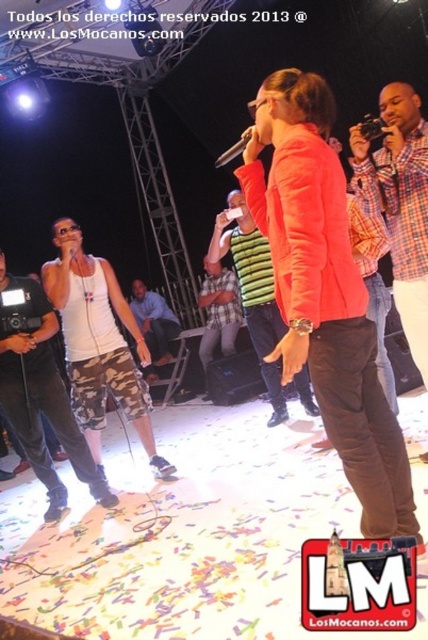
Between point (365, 161) and point (225, 308), which one is positioned in front?

Point (365, 161)

Can you confirm if plaid shirt at upper right is bigger than green striped shirt at center?

Actually, plaid shirt at upper right might be smaller than green striped shirt at center.

Locate an element on the screen. This screenshot has width=428, height=640. plaid shirt at upper right is located at coordinates (400, 204).

Find the location of `white camo pants at left`. white camo pants at left is located at coordinates (39, 390).

Does white camo pants at left appear on the left side of green striped shirt at center?

Indeed, white camo pants at left is positioned on the left side of green striped shirt at center.

Describe the element at coordinates (39, 390) in the screenshot. I see `white camo pants at left` at that location.

The image size is (428, 640). Find the location of `white camo pants at left`. white camo pants at left is located at coordinates (39, 390).

Can you confirm if white matte tank top at left is shorter than blue plaid shirt at center?

No, white matte tank top at left is not shorter than blue plaid shirt at center.

Where is `white matte tank top at left`? Image resolution: width=428 pixels, height=640 pixels. white matte tank top at left is located at coordinates (98, 342).